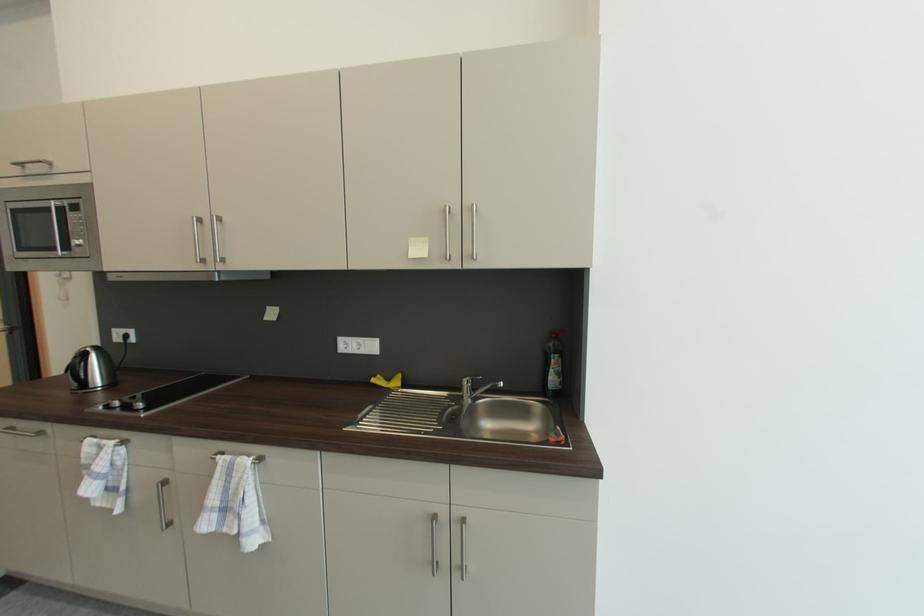
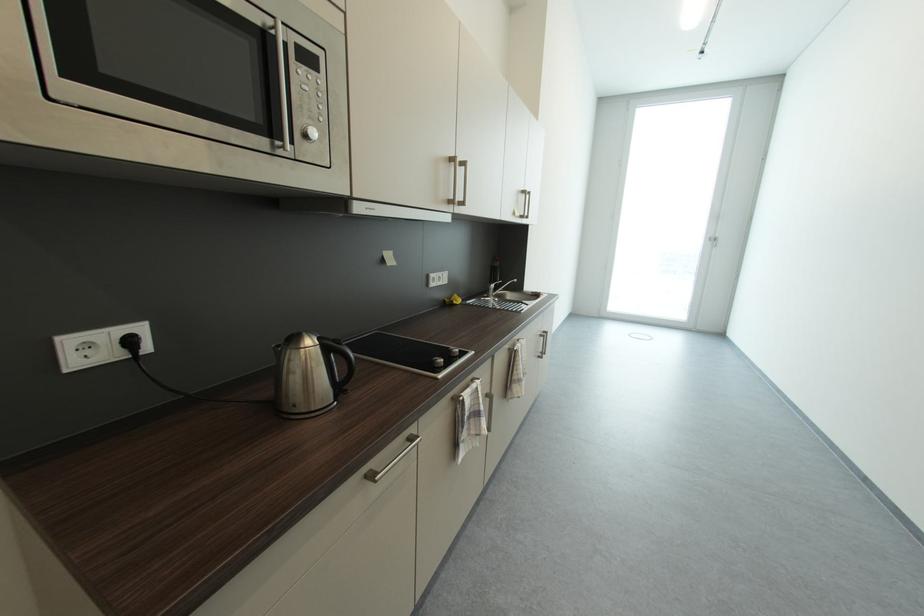
Where in the second image is the point corresponding to pixel 222 461 from the first image?

(523, 351)